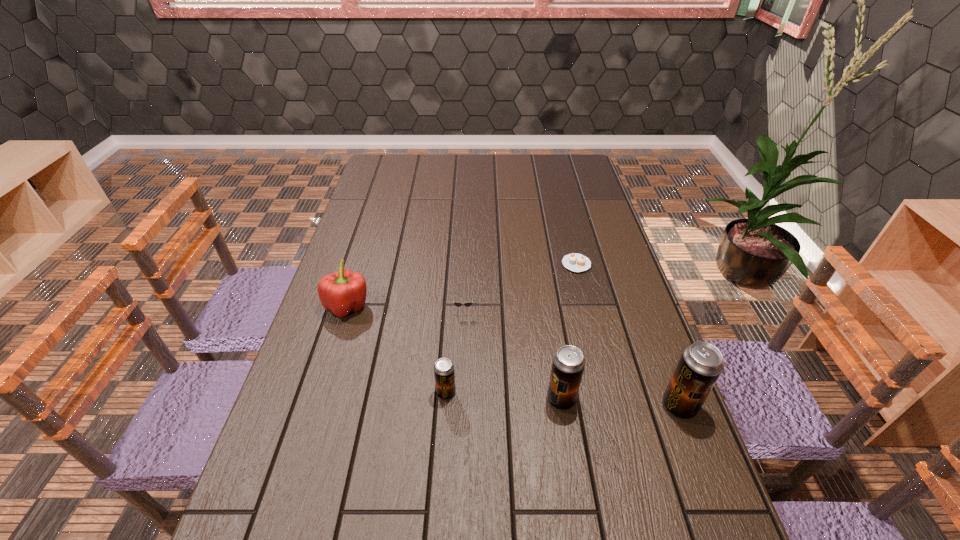
Where is `free space located 0.110m on the front of the rightmost beer can`? The width and height of the screenshot is (960, 540). free space located 0.110m on the front of the rightmost beer can is located at coordinates 704,470.

I want to click on vacant space located in front of the lenses of the sunglasses, so click(459, 445).

This screenshot has width=960, height=540. I want to click on vacant region located 0.350m on the right of the leftmost object, so click(x=492, y=306).

At what (x,y) coordinates should I click in order to perform the action: click on free space located 0.070m on the front of the farthest object. Please return your answer as a coordinate pair (x, y). The width and height of the screenshot is (960, 540). Looking at the image, I should click on (583, 289).

This screenshot has height=540, width=960. I want to click on object at the left edge, so click(344, 291).

What are the coordinates of `beer can located in the right edge section of the desktop` in the screenshot? It's located at (701, 363).

This screenshot has width=960, height=540. I want to click on cupcake present at the right edge, so click(575, 262).

In the image, there is a desktop. Find the location of `free space at the far edge`. free space at the far edge is located at coordinates (432, 157).

At what (x,y) coordinates should I click in order to perform the action: click on free spot at the near edge of the desktop. Please return your answer as a coordinate pair (x, y). Image resolution: width=960 pixels, height=540 pixels. Looking at the image, I should click on (513, 510).

The height and width of the screenshot is (540, 960). I want to click on free location at the left edge, so (x=394, y=228).